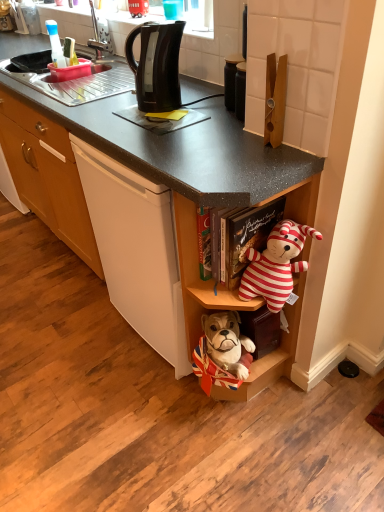
Locate an element on the screen. This screenshot has width=384, height=512. free space to the left of wooden shelf at lower center is located at coordinates (157, 397).